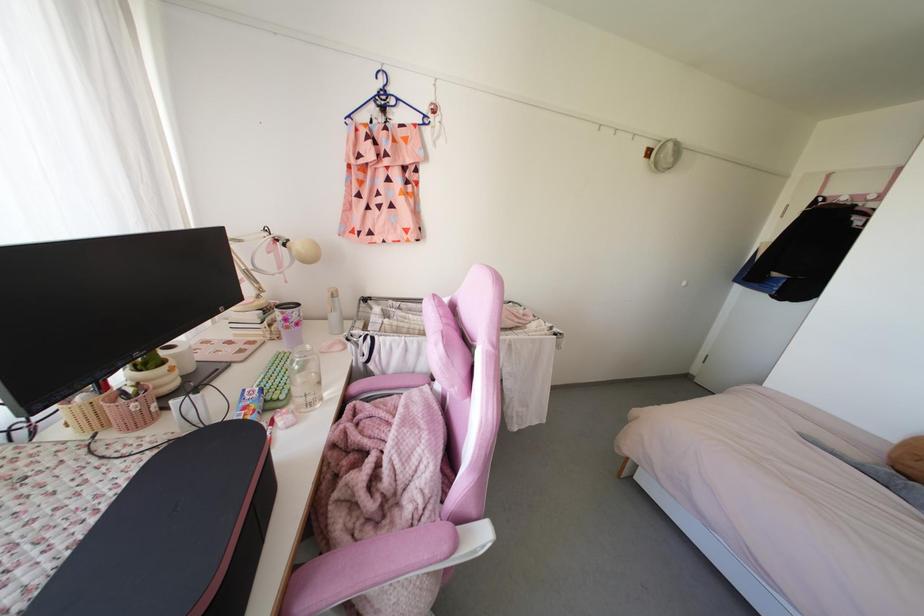
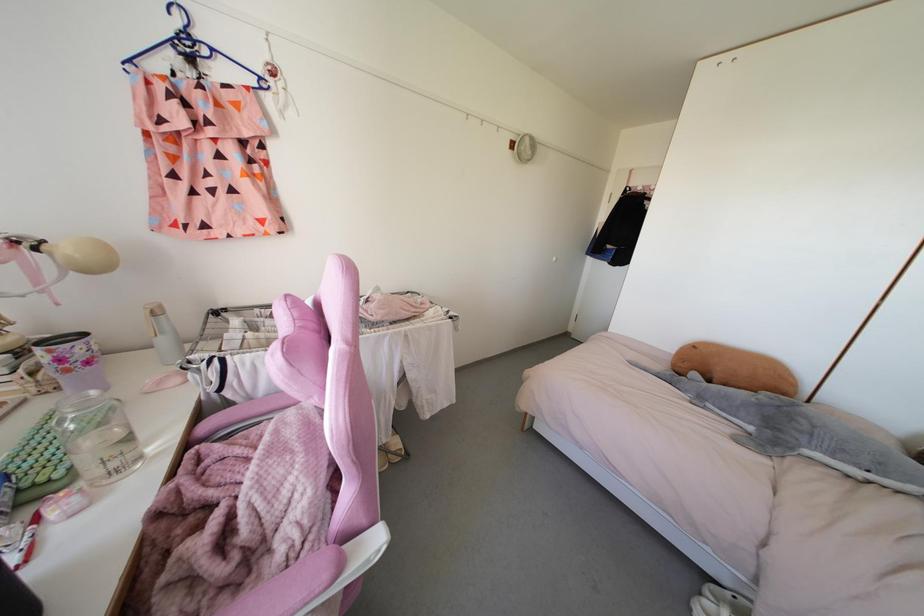
Question: What movement of the cameraman would produce the second image?

Choices:
 (A) Left
 (B) Right
 (C) Forward
 (D) Backward

Answer: (B)